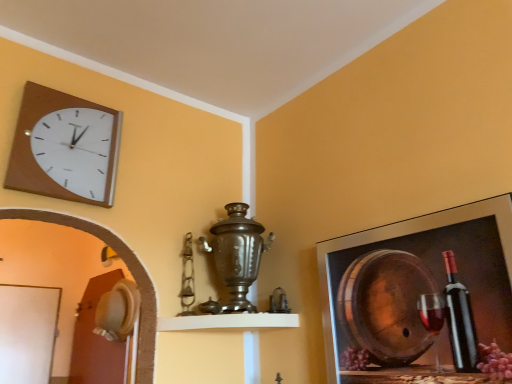
The width and height of the screenshot is (512, 384). In order to click on free space to the back side of matte brown clock at upper left in this screenshot , I will do `click(80, 217)`.